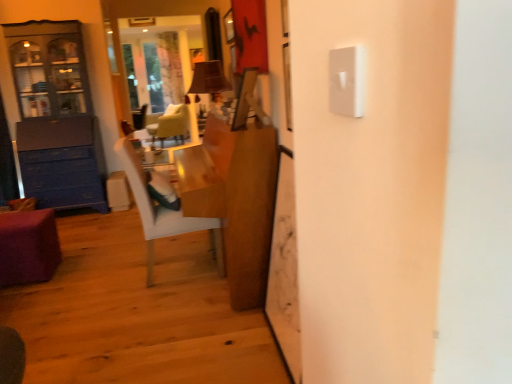
Question: From the image's perspective, is light green fabric chair at center, which ranks as the 1th chair in top-to-bottom order, above or below white glossy chair at center, which is counted as the 1th chair, starting from the bottom?

Choices:
 (A) below
 (B) above

Answer: (B)

Question: Relative to white glossy chair at center, the second chair viewed from the top, is light green fabric chair at center, the second chair when ordered from bottom to top, in front or behind?

Choices:
 (A) behind
 (B) front

Answer: (A)

Question: Estimate the real-world distances between objects in this image. Which object is closer to the white glossy chair at center, the first chair positioned from the right?

Choices:
 (A) white textured curtain at upper center
 (B) wooden desk at center
 (C) purple fabric ottoman at lower left
 (D) matte blue cabinet at left
 (E) light green fabric chair at center, which ranks as the 1th chair in top-to-bottom order

Answer: (B)

Question: Which object is positioned farthest from the wooden desk at center?

Choices:
 (A) light green fabric chair at center, which is counted as the 2th chair, starting from the right
 (B) matte blue cabinet at left
 (C) white textured curtain at upper center
 (D) purple fabric ottoman at lower left
 (E) white glossy chair at center, arranged as the 2th chair when viewed from the left

Answer: (C)